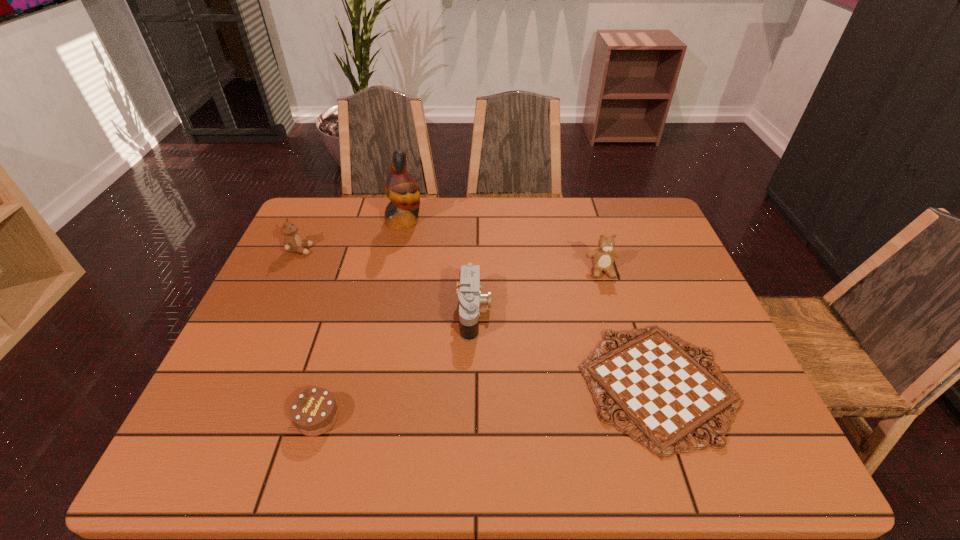
I want to click on free space between the shortest object and the left teddy bear, so click(x=479, y=317).

Find the location of a particular element. The height and width of the screenshot is (540, 960). free area in between the chocolate cake and the fourth object from left to right is located at coordinates pos(396,364).

Locate an element on the screen. This screenshot has width=960, height=540. free space between the chocolate cake and the third shortest object is located at coordinates (396, 364).

Where is `vacant space that's between the chocolate cake and the chessboard`? vacant space that's between the chocolate cake and the chessboard is located at coordinates (488, 401).

Locate an element on the screen. This screenshot has width=960, height=540. free area in between the fifth tallest object and the fifth nearest object is located at coordinates (309, 334).

Where is `free space between the fifth nearest object and the chocolate cake`? free space between the fifth nearest object and the chocolate cake is located at coordinates (309, 334).

What are the coordinates of `free space between the fifth nearest object and the right teddy bear` in the screenshot? It's located at point(451,260).

At what (x,y) coordinates should I click in order to perform the action: click on vacant area between the camera and the chessboard. Please return your answer as a coordinate pair (x, y). Looking at the image, I should click on (566, 348).

Identify the location of vacant area that lies between the fourth tallest object and the nearer teddy bear. The height and width of the screenshot is (540, 960). (538, 292).

Where is `the fourth closest object to the second shortest object`? The image size is (960, 540). the fourth closest object to the second shortest object is located at coordinates (403, 191).